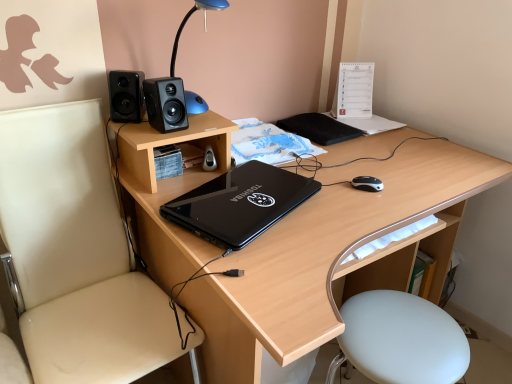
Question: Does black matte notepad at upper right have a lesser width compared to black matte speaker at upper center, which appears as the first speaker when viewed from the right?

Choices:
 (A) yes
 (B) no

Answer: (B)

Question: Is black matte notepad at upper right bigger than black matte speaker at upper center, arranged as the 2th speaker when viewed from the left?

Choices:
 (A) yes
 (B) no

Answer: (A)

Question: Is black matte notepad at upper right in front of black matte speaker at upper center, arranged as the 2th speaker when viewed from the left?

Choices:
 (A) no
 (B) yes

Answer: (A)

Question: Is black matte notepad at upper right further to the viewer compared to black matte speaker at upper center, arranged as the 2th speaker when viewed from the left?

Choices:
 (A) no
 (B) yes

Answer: (B)

Question: Is black matte notepad at upper right taller than black matte speaker at upper center, which appears as the first speaker when viewed from the right?

Choices:
 (A) no
 (B) yes

Answer: (A)

Question: Based on their positions, is wooden desk at center located to the left or right of black matte speaker at upper left, arranged as the 2th speaker when viewed from the right?

Choices:
 (A) left
 (B) right

Answer: (B)

Question: In the image, is wooden desk at center positioned in front of or behind black matte speaker at upper left, arranged as the 2th speaker when viewed from the right?

Choices:
 (A) behind
 (B) front

Answer: (B)

Question: Considering the positions of point (269, 327) and point (116, 97), is point (269, 327) closer or farther from the camera than point (116, 97)?

Choices:
 (A) farther
 (B) closer

Answer: (B)

Question: Considering the positions of wooden desk at center and black matte speaker at upper left, acting as the 1th speaker starting from the left, in the image, is wooden desk at center bigger or smaller than black matte speaker at upper left, acting as the 1th speaker starting from the left,?

Choices:
 (A) small
 (B) big

Answer: (B)

Question: Considering their positions, is white leather bar stool at lower right located in front of or behind black matte speaker at upper center, arranged as the 2th speaker when viewed from the left?

Choices:
 (A) front
 (B) behind

Answer: (A)

Question: From a real-world perspective, is white leather bar stool at lower right above or below black matte speaker at upper center, which appears as the first speaker when viewed from the right?

Choices:
 (A) above
 (B) below

Answer: (B)

Question: Would you say white leather bar stool at lower right is to the left or to the right of black matte speaker at upper center, arranged as the 2th speaker when viewed from the left, in the picture?

Choices:
 (A) right
 (B) left

Answer: (A)

Question: From their relative heights in the image, would you say white leather bar stool at lower right is taller or shorter than black matte speaker at upper center, arranged as the 2th speaker when viewed from the left?

Choices:
 (A) tall
 (B) short

Answer: (A)

Question: Relative to black matte notepad at upper right, is black matte speaker at upper left, arranged as the 2th speaker when viewed from the right, in front or behind?

Choices:
 (A) front
 (B) behind

Answer: (A)

Question: Is black matte speaker at upper left, acting as the 1th speaker starting from the left, wider or thinner than black matte notepad at upper right?

Choices:
 (A) thin
 (B) wide

Answer: (A)